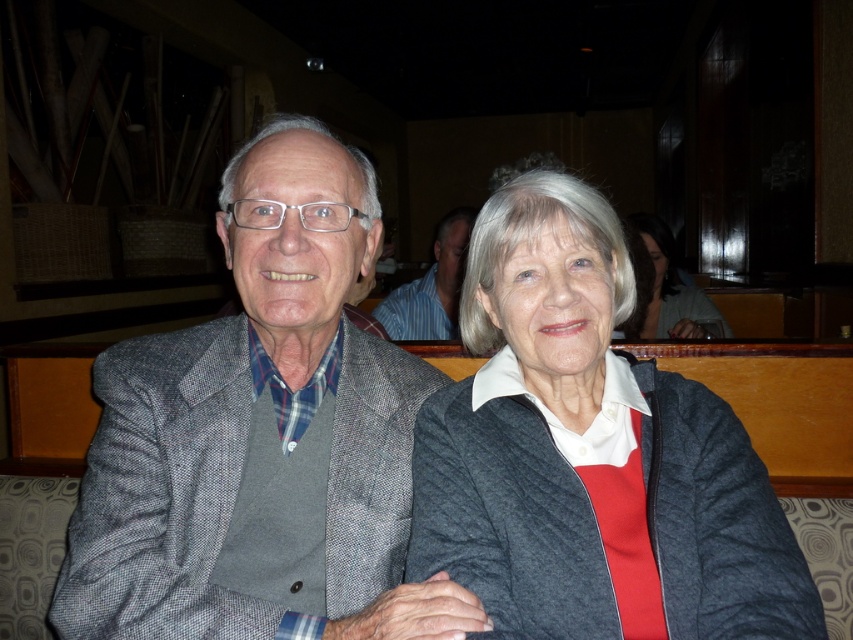
You are a photographer adjusting your camera to focus on the matte gray jacket at center and the striped shirt at center. Which object should you focus on first if you want to capture both in sharp focus?

The matte gray jacket at center is positioned under the striped shirt at center, so you should focus on the striped shirt at center first to ensure both are in sharp focus since it is closer to the camera.

You are taking a photo of two people sitting at a table. You notice two points marked in the image, one at coordinates point (311, 166) and another at point (669, 288). Which point is nearer to the camera?

Point (311, 166) is closer to the camera than point (669, 288).